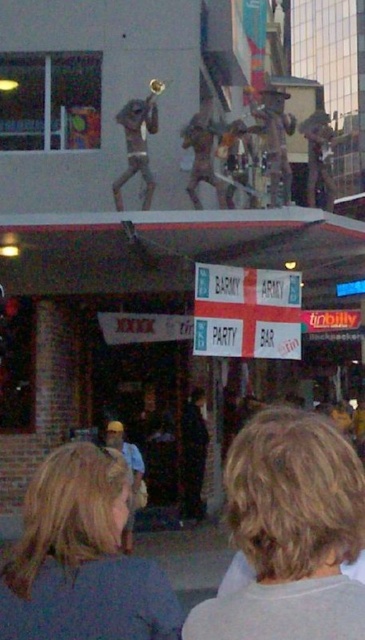
Can you confirm if blonde hair at center is positioned above bronze statue at upper center?

Actually, blonde hair at center is below bronze statue at upper center.

Between blonde hair at center and bronze statue at upper center, which one is positioned lower?

blonde hair at center

Where is `blonde hair at center`? blonde hair at center is located at coordinates point(290,532).

Between blonde hair at lower left and bronze statue at upper center, which one is positioned higher?

Positioned higher is bronze statue at upper center.

This screenshot has height=640, width=365. What do you see at coordinates (82, 557) in the screenshot? I see `blonde hair at lower left` at bounding box center [82, 557].

Find the location of a particular element. blonde hair at lower left is located at coordinates (82, 557).

Which of these two, blonde hair at center or blonde hair at lower left, stands shorter?

blonde hair at lower left

Can you confirm if blonde hair at center is positioned to the left of blonde hair at lower left?

Incorrect, blonde hair at center is not on the left side of blonde hair at lower left.

Is point (340, 541) farther from viewer compared to point (104, 513)?

That is False.

Where is `blonde hair at center`? The width and height of the screenshot is (365, 640). blonde hair at center is located at coordinates (290, 532).